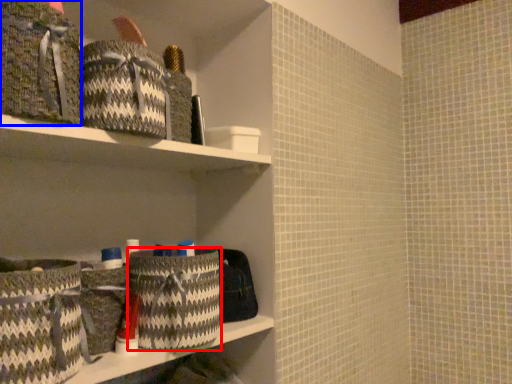
Question: Which object appears closest to the camera in this image, laundry basket (highlighted by a red box) or material (highlighted by a blue box)?

Choices:
 (A) laundry basket
 (B) material

Answer: (B)